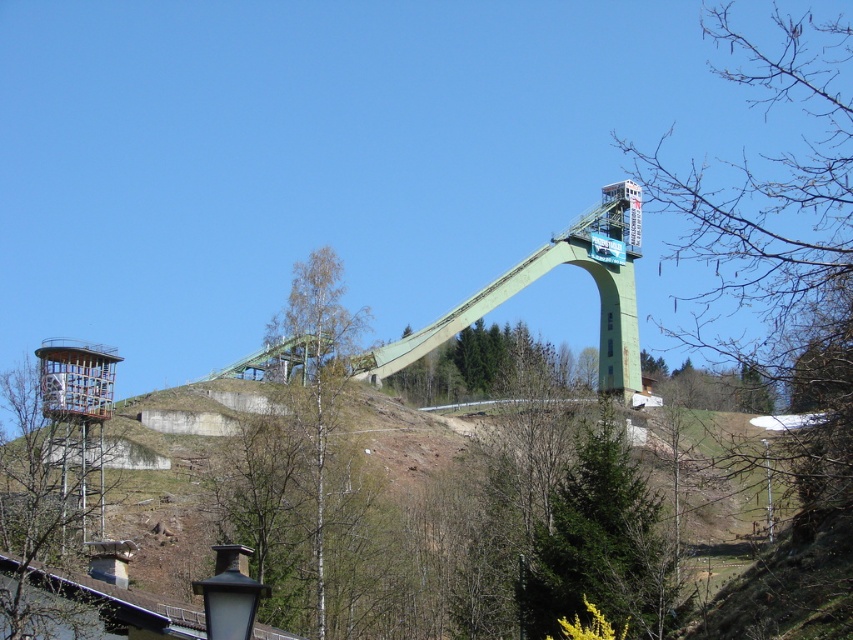
Does point (48, 536) come behind point (341, 321)?

No, (48, 536) is in front of (341, 321).

Is point (78, 445) positioned before point (305, 275)?

Yes, it is.

Locate an element on the screen. The width and height of the screenshot is (853, 640). green wooden tower at left is located at coordinates (51, 472).

Can you confirm if green wooden tower at left is positioned to the left of green concrete ski jump at center?

Yes, green wooden tower at left is to the left of green concrete ski jump at center.

From the picture: Is green wooden tower at left shorter than green concrete ski jump at center?

Indeed, green wooden tower at left has a lesser height compared to green concrete ski jump at center.

Does point (73, 492) lie behind point (601, 196)?

No, (73, 492) is closer to viewer.

This screenshot has height=640, width=853. Find the location of `green wooden tower at left`. green wooden tower at left is located at coordinates (51, 472).

Can you confirm if bare branches at upper right is smaller than green textured tree at lower center?

Incorrect, bare branches at upper right is not smaller in size than green textured tree at lower center.

Does point (717, 204) lie behind point (605, 545)?

Yes, it is.

Identify the location of bare branches at upper right. (781, 228).